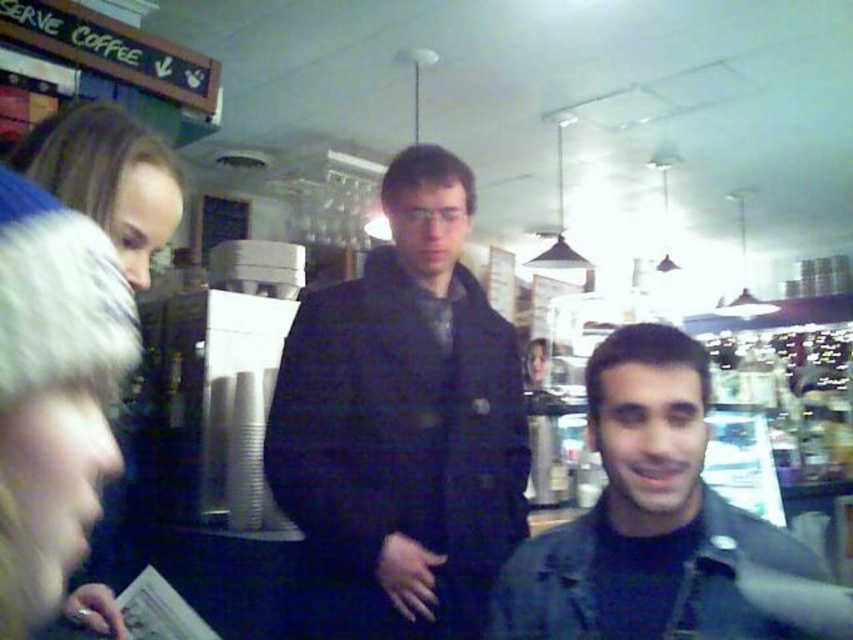
Question: Considering the real-world distances, which object is farthest from the matte black jacket at lower right?

Choices:
 (A) blonde hair at left
 (B) green painted wood signboard at upper left
 (C) dark blue jacket at center

Answer: (B)

Question: Which point appears closest to the camera in this image?

Choices:
 (A) (61, 160)
 (B) (451, 385)

Answer: (A)

Question: Does blonde hair at left have a smaller size compared to green painted wood signboard at upper left?

Choices:
 (A) yes
 (B) no

Answer: (A)

Question: Can you confirm if blonde hair at left is bigger than green painted wood signboard at upper left?

Choices:
 (A) no
 (B) yes

Answer: (A)

Question: Considering the real-world distances, which object is farthest from the green painted wood signboard at upper left?

Choices:
 (A) matte black jacket at lower right
 (B) dark blue jacket at center
 (C) blonde hair at left

Answer: (A)

Question: Is matte black jacket at lower right positioned behind green painted wood signboard at upper left?

Choices:
 (A) no
 (B) yes

Answer: (A)